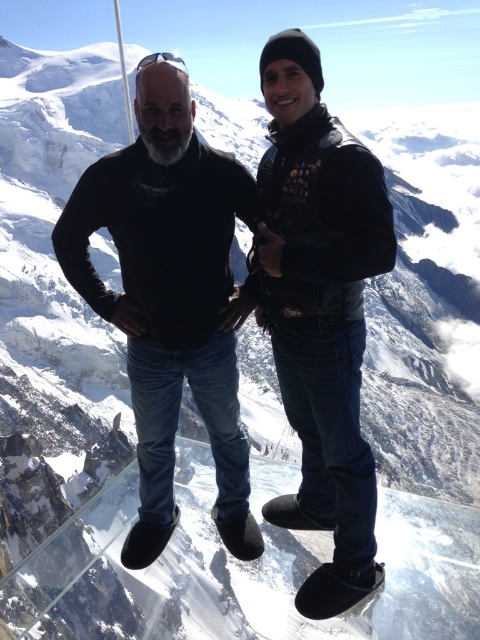
Can you confirm if black matte sweater at center is positioned above black leather jacket at center?

Yes.

Can you confirm if black matte sweater at center is taller than black leather jacket at center?

In fact, black matte sweater at center may be shorter than black leather jacket at center.

At what (x,y) coordinates should I click in order to perform the action: click on black matte sweater at center. Please return your answer as a coordinate pair (x, y). Looking at the image, I should click on (169, 298).

Locate an element on the screen. This screenshot has height=640, width=480. black matte sweater at center is located at coordinates (169, 298).